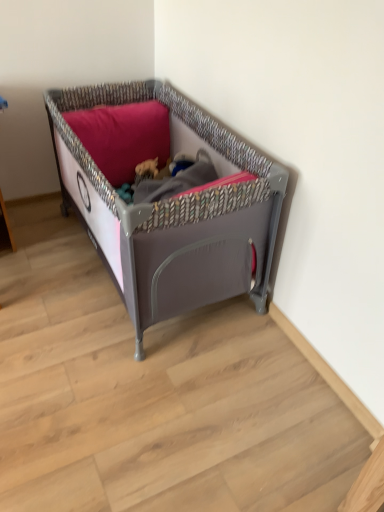
Question: Based on their positions, is matte gray plastic playpen at center located to the left or right of matte pink pillow at upper center?

Choices:
 (A) right
 (B) left

Answer: (A)

Question: Looking at the image, does matte gray plastic playpen at center seem bigger or smaller compared to matte pink pillow at upper center?

Choices:
 (A) small
 (B) big

Answer: (B)

Question: Considering the positions of matte gray plastic playpen at center and matte pink pillow at upper center in the image, is matte gray plastic playpen at center taller or shorter than matte pink pillow at upper center?

Choices:
 (A) tall
 (B) short

Answer: (A)

Question: Relative to matte gray plastic playpen at center, is matte pink pillow at upper center in front or behind?

Choices:
 (A) behind
 (B) front

Answer: (A)

Question: From their relative heights in the image, would you say matte pink pillow at upper center is taller or shorter than matte gray plastic playpen at center?

Choices:
 (A) short
 (B) tall

Answer: (A)

Question: From a real-world perspective, is matte pink pillow at upper center above or below matte gray plastic playpen at center?

Choices:
 (A) above
 (B) below

Answer: (A)

Question: Do you think matte pink pillow at upper center is within matte gray plastic playpen at center, or outside of it?

Choices:
 (A) outside
 (B) inside

Answer: (B)